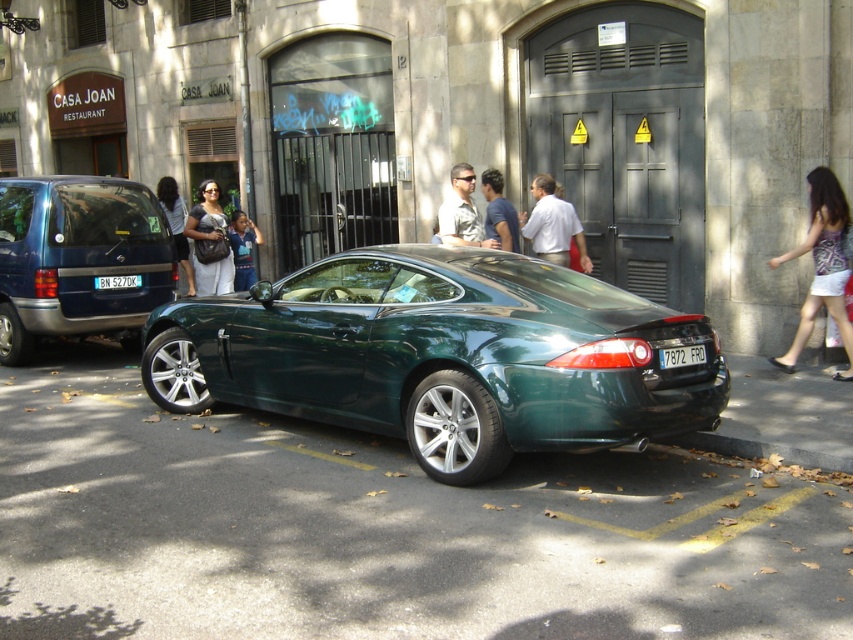
Can you confirm if green asphalt at center is taller than matte green car at center?

No.

Who is taller, green asphalt at center or matte green car at center?

matte green car at center is taller.

This screenshot has width=853, height=640. What do you see at coordinates (381, 529) in the screenshot?
I see `green asphalt at center` at bounding box center [381, 529].

Identify the location of green asphalt at center. (381, 529).

Can you confirm if white denim shorts at right is positioned to the right of matte black jacket at center?

Indeed, white denim shorts at right is positioned on the right side of matte black jacket at center.

Does white denim shorts at right have a greater height compared to matte black jacket at center?

Yes, white denim shorts at right is taller than matte black jacket at center.

This screenshot has height=640, width=853. I want to click on white denim shorts at right, so click(821, 266).

Can you confirm if matte khaki shirt at center is wider than matte black jacket at center?

No.

What do you see at coordinates (462, 212) in the screenshot?
I see `matte khaki shirt at center` at bounding box center [462, 212].

Does point (477, 221) lie behind point (173, 211)?

No, (477, 221) is in front of (173, 211).

At what (x,y) coordinates should I click in order to perform the action: click on matte khaki shirt at center. Please return your answer as a coordinate pair (x, y). Looking at the image, I should click on (462, 212).